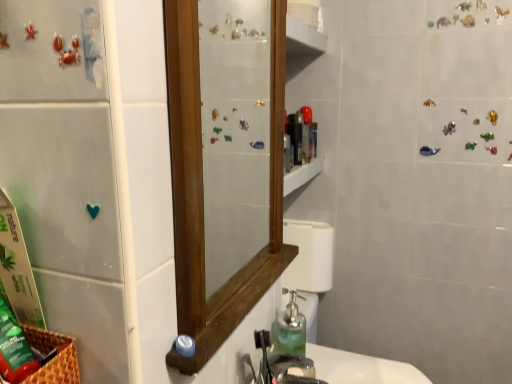
Question: Considering the relative sizes of translucent glass soap dispenser at lower center and metallic silver faucet at sink center in the image provided, is translucent glass soap dispenser at lower center thinner than metallic silver faucet at sink center?

Choices:
 (A) yes
 (B) no

Answer: (A)

Question: Is translucent glass soap dispenser at lower center at the right side of metallic silver faucet at sink center?

Choices:
 (A) no
 (B) yes

Answer: (B)

Question: From a real-world perspective, is translucent glass soap dispenser at lower center under metallic silver faucet at sink center?

Choices:
 (A) no
 (B) yes

Answer: (A)

Question: Is translucent glass soap dispenser at lower center behind metallic silver faucet at sink center?

Choices:
 (A) no
 (B) yes

Answer: (B)

Question: From the image's perspective, would you say translucent glass soap dispenser at lower center is positioned over metallic silver faucet at sink center?

Choices:
 (A) yes
 (B) no

Answer: (A)

Question: Does translucent glass soap dispenser at lower center have a larger size compared to metallic silver faucet at sink center?

Choices:
 (A) no
 (B) yes

Answer: (A)

Question: From a real-world perspective, is translucent plastic container at upper center under white glossy sink at lower center, the 1th sink positioned from the front?

Choices:
 (A) no
 (B) yes

Answer: (A)

Question: Does translucent plastic container at upper center appear on the left side of white glossy sink at lower center, the 1th sink positioned from the front?

Choices:
 (A) no
 (B) yes

Answer: (B)

Question: Can you confirm if translucent plastic container at upper center is smaller than white glossy sink at lower center, the 2th sink positioned from the back?

Choices:
 (A) yes
 (B) no

Answer: (A)

Question: Considering the relative positions of translucent plastic container at upper center and white glossy sink at lower center, the 2th sink positioned from the back, in the image provided, is translucent plastic container at upper center to the right of white glossy sink at lower center, the 2th sink positioned from the back, from the viewer's perspective?

Choices:
 (A) no
 (B) yes

Answer: (A)

Question: From the image's perspective, would you say translucent plastic container at upper center is positioned over white glossy sink at lower center, the 1th sink positioned from the front?

Choices:
 (A) yes
 (B) no

Answer: (A)

Question: Are translucent plastic container at upper center and white glossy sink at lower center, the 1th sink positioned from the front, making contact?

Choices:
 (A) no
 (B) yes

Answer: (A)

Question: From a real-world perspective, is metallic silver faucet at sink center on top of translucent glass soap dispenser at lower center?

Choices:
 (A) no
 (B) yes

Answer: (A)